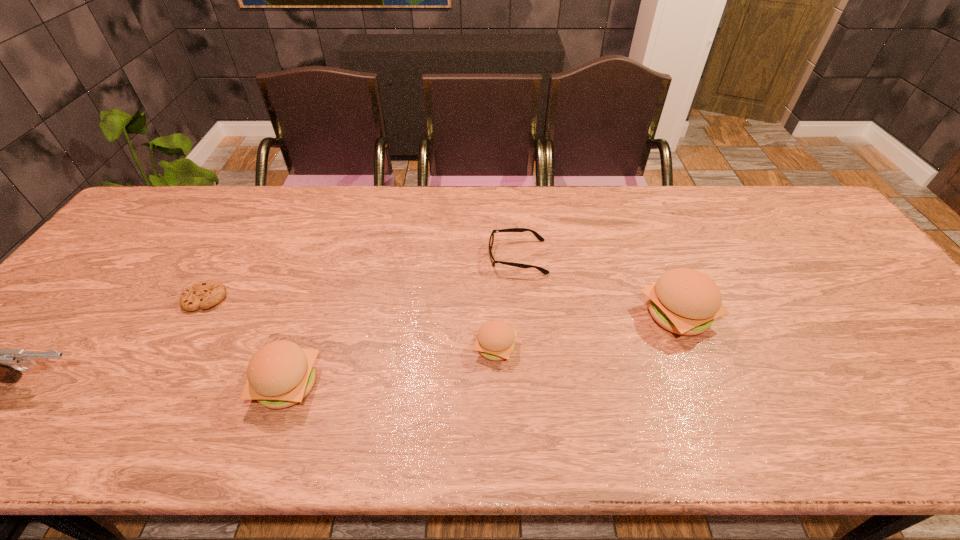
At what (x,y) coordinates should I click in order to perform the action: click on vacant space located 0.050m on the left of the third shortest object. Please return your answer as a coordinate pair (x, y). Looking at the image, I should click on tap(452, 347).

Where is `vacant region located on the left of the rightmost hamburger`? The width and height of the screenshot is (960, 540). vacant region located on the left of the rightmost hamburger is located at coordinates (510, 315).

Locate an element on the screen. This screenshot has width=960, height=540. vacant space located 0.290m on the front-facing side of the spectacles is located at coordinates (388, 257).

You are a GUI agent. You are given a task and a screenshot of the screen. Output one action in this format:
    pyautogui.click(x=<x>, y=<y>)
    Task: Click on the blank space located 0.170m on the front-facing side of the spectacles
    The height and width of the screenshot is (540, 960).
    Given the screenshot: What is the action you would take?
    pyautogui.click(x=430, y=257)

Find the location of a particular element. This screenshot has height=540, width=960. vacant space located 0.050m on the front-facing side of the spectacles is located at coordinates (471, 257).

Locate an element on the screen. Image resolution: width=960 pixels, height=540 pixels. free space located on the back of the fifth object from right to left is located at coordinates (252, 217).

I want to click on object located in the near edge section of the desktop, so click(x=280, y=374).

Identify the location of free location at the far edge of the desktop. This screenshot has height=540, width=960. (755, 197).

Identify the location of free space at the near edge of the desktop. (179, 400).

The height and width of the screenshot is (540, 960). Find the location of `blank space at the left edge`. blank space at the left edge is located at coordinates (119, 308).